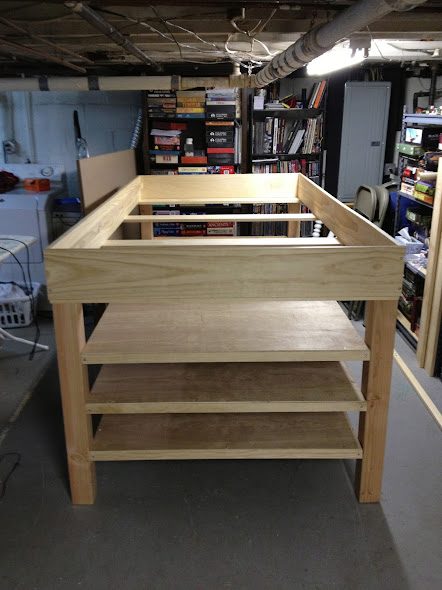
Find the location of a particular element. door is located at coordinates pyautogui.click(x=351, y=142).